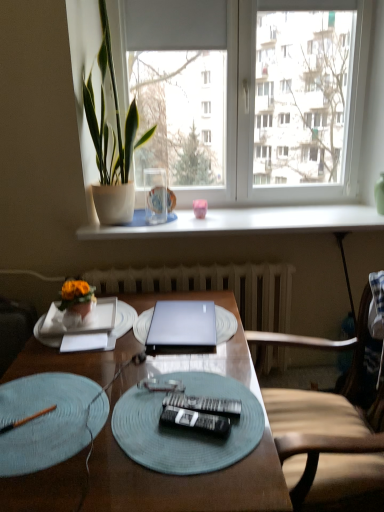
At what (x,y) coordinates should I click in order to perform the action: click on vacant area to the right of black plastic remote control at center, marked as the second remote control in a back-to-front arrangement. Please return your answer as a coordinate pair (x, y). Looking at the image, I should click on pos(249,428).